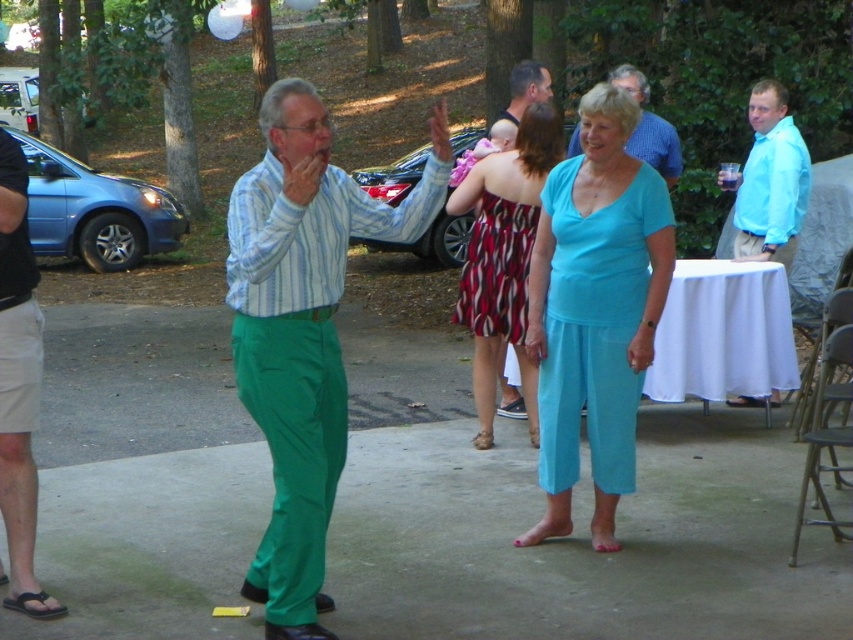
Is dark green shorts at left thinner than light blue shirt at right?

Yes.

Is point (26, 275) positioned after point (793, 250)?

No, it is in front of (793, 250).

What are the coordinates of `dark green shorts at left` in the screenshot? It's located at (18, 385).

Between teal fabric pants at center and light blue shirt at right, which one is positioned lower?

Positioned lower is teal fabric pants at center.

Does teal fabric pants at center appear under light blue shirt at right?

Yes, teal fabric pants at center is below light blue shirt at right.

Is point (585, 220) in front of point (779, 193)?

Yes, it is in front of point (779, 193).

Locate an element on the screen. teal fabric pants at center is located at coordinates (595, 310).

Who is lower down, dark green shorts at left or matte blue shirt at center?

dark green shorts at left is below.

Who is more distant from viewer, (27, 548) or (639, 157)?

Point (639, 157)

Image resolution: width=853 pixels, height=640 pixels. I want to click on dark green shorts at left, so click(18, 385).